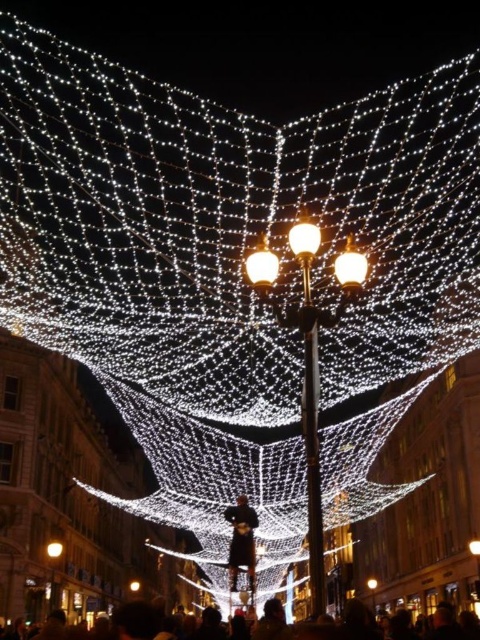
Question: Which object is positioned farthest from the matte glass streetlight at center?

Choices:
 (A) illuminated wire mesh at center
 (B) dark brown leather jacket at center

Answer: (B)

Question: From the image, what is the correct spatial relationship of dark brown leather jacket at center in relation to illuminated wire mesh at center?

Choices:
 (A) above
 (B) below

Answer: (B)

Question: Can you confirm if white glossy streetlight at center is positioned to the right of illuminated wire mesh at center?

Choices:
 (A) no
 (B) yes

Answer: (B)

Question: Which of the following is the farthest from the observer?

Choices:
 (A) (232, 566)
 (B) (319, 230)
 (C) (319, 451)
 (D) (214, 609)

Answer: (D)

Question: Does dark brown leather jacket at center appear under matte gold streetlight at center?

Choices:
 (A) yes
 (B) no

Answer: (A)

Question: Which point is closer to the camera?

Choices:
 (A) matte gold streetlight at center
 (B) white glossy streetlight at center
 (C) matte glass streetlight at center

Answer: (C)